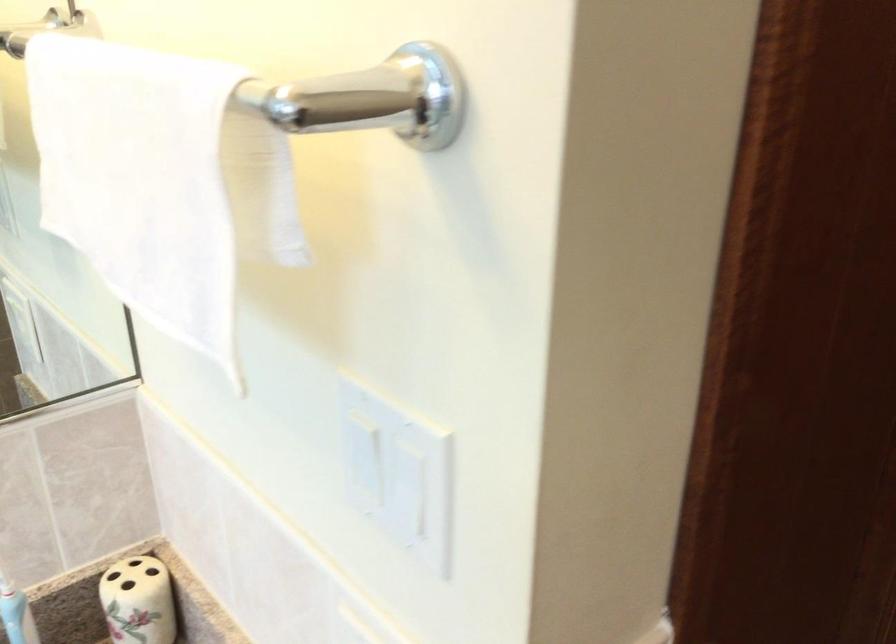
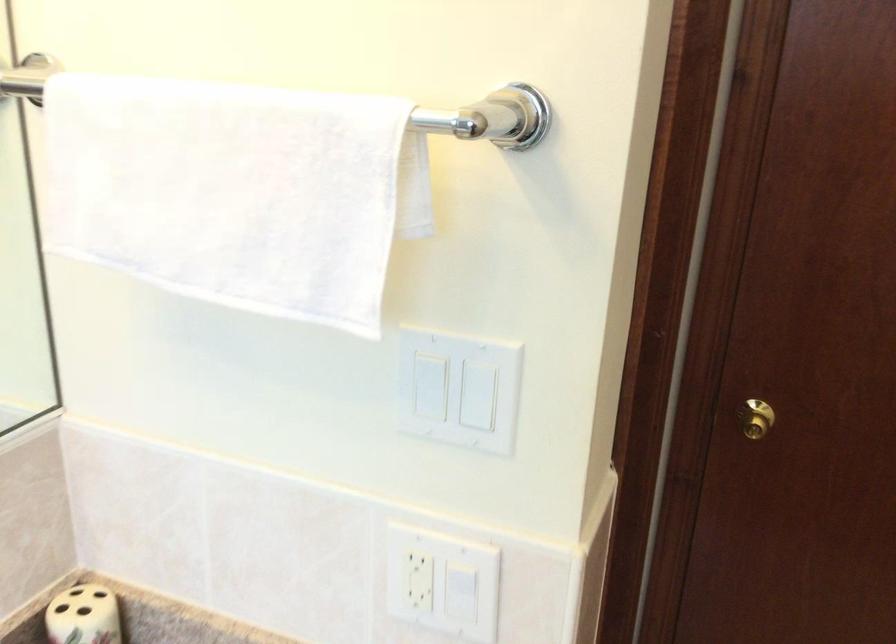
Where in the second image is the point corresponding to (x=406, y=465) from the first image?

(458, 389)